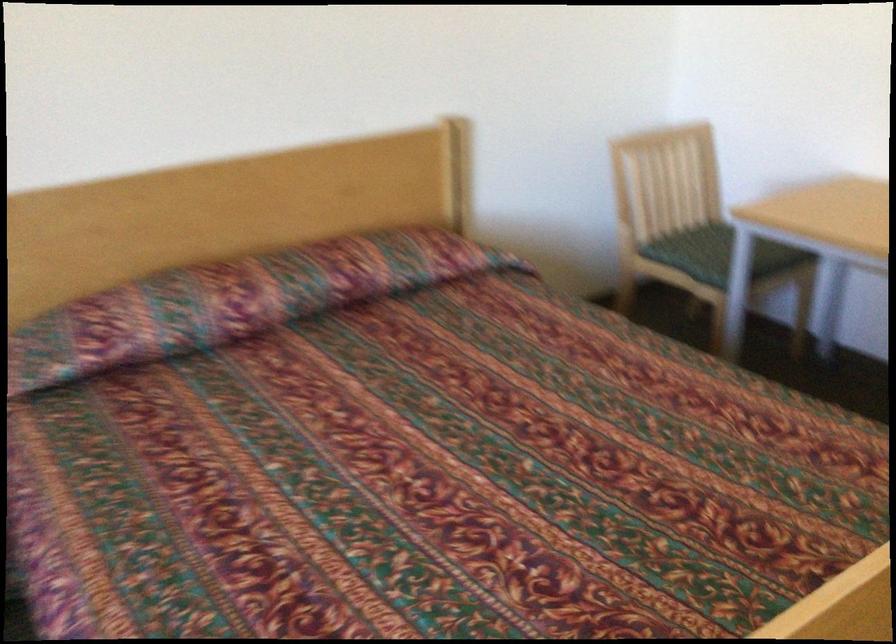
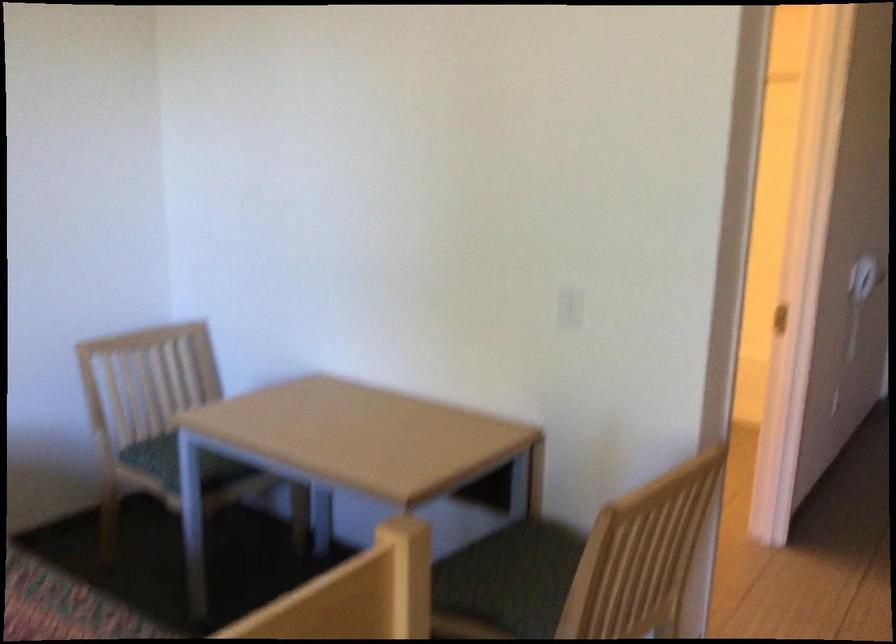
Question: What movement of the cameraman would produce the second image?

Choices:
 (A) Left
 (B) Right
 (C) Forward
 (D) Backward

Answer: (B)